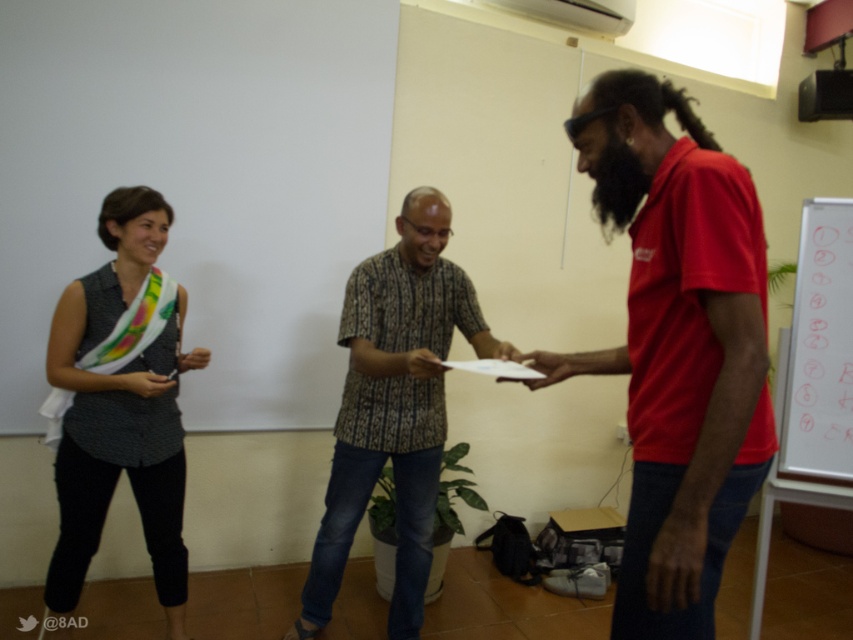
Which of these two, brown patterned shirt at center or white paperboard at right, stands shorter?

With less height is white paperboard at right.

Does brown patterned shirt at center appear on the left side of white paperboard at right?

Yes, brown patterned shirt at center is to the left of white paperboard at right.

This screenshot has width=853, height=640. In order to click on brown patterned shirt at center in this screenshot , I will do `click(393, 406)`.

Locate an element on the screen. Image resolution: width=853 pixels, height=640 pixels. brown patterned shirt at center is located at coordinates (393, 406).

Looking at this image, who is higher up, red matte shirt at right or brown patterned shirt at center?

Positioned higher is red matte shirt at right.

What do you see at coordinates (676, 346) in the screenshot? Image resolution: width=853 pixels, height=640 pixels. I see `red matte shirt at right` at bounding box center [676, 346].

Identify the location of red matte shirt at right. (676, 346).

Measure the distance from red matte shirt at right to white paperboard at right.

A distance of 1.20 meters exists between red matte shirt at right and white paperboard at right.

Is red matte shirt at right to the right of white paperboard at right from the viewer's perspective?

Incorrect, red matte shirt at right is not on the right side of white paperboard at right.

Between point (699, 332) and point (849, 300), which one is positioned in front?

Point (699, 332) is in front.

Locate an element on the screen. This screenshot has width=853, height=640. red matte shirt at right is located at coordinates (676, 346).